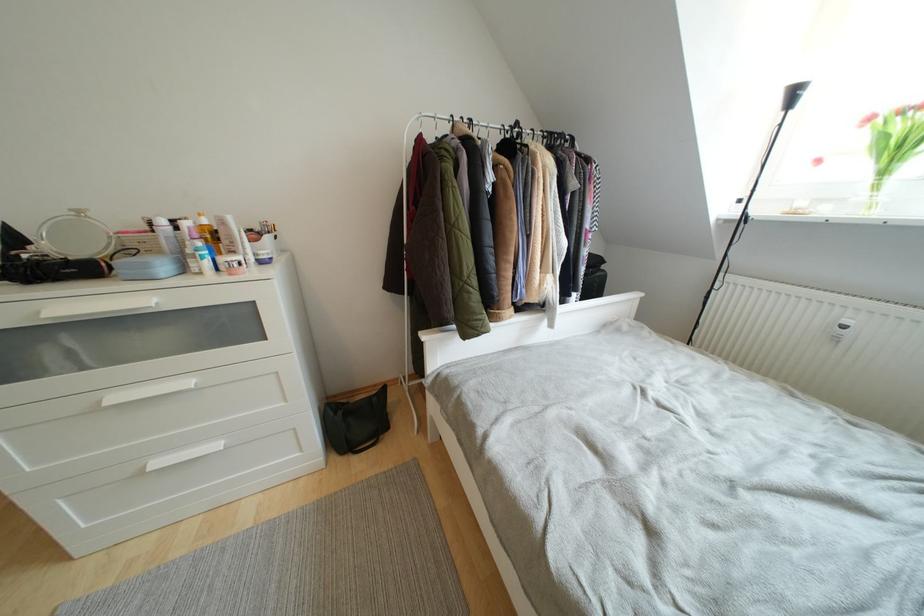
Where would you lift the white spray bottle? Please return your answer as a coordinate pair (x, y).

(202, 257)